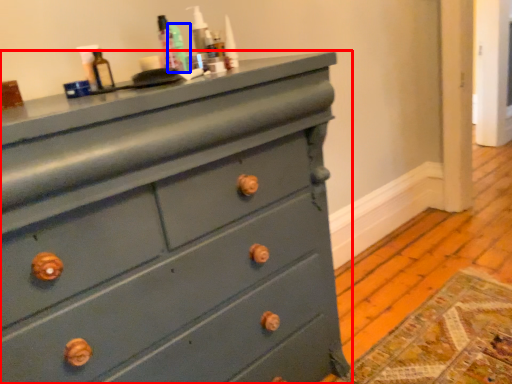
Question: Which of the following is the farthest to the observer, chest of drawers (highlighted by a red box) or teal (highlighted by a blue box)?

Choices:
 (A) chest of drawers
 (B) teal

Answer: (B)